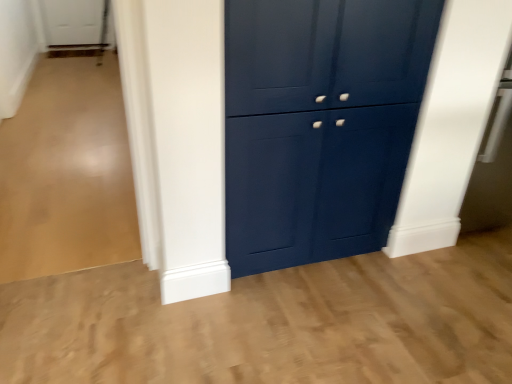
The width and height of the screenshot is (512, 384). What do you see at coordinates (319, 124) in the screenshot? I see `glossy blue cupboard at center` at bounding box center [319, 124].

Measure the distance between point (227, 208) and camera.

They are 1.66 meters apart.

Locate an element on the screen. The width and height of the screenshot is (512, 384). glossy blue cupboard at center is located at coordinates (319, 124).

Locate an element on the screen. The height and width of the screenshot is (384, 512). glossy blue cupboard at center is located at coordinates (319, 124).